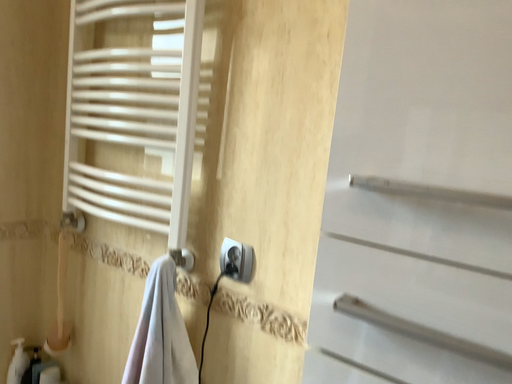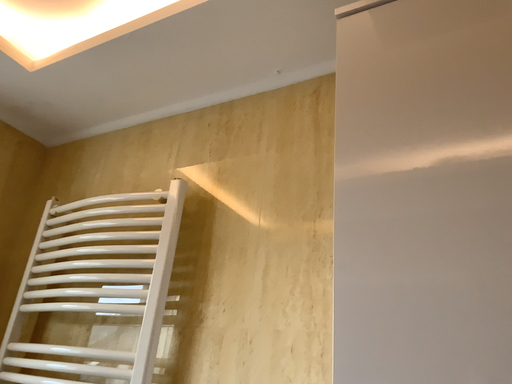
Question: How did the camera likely rotate when shooting the video?

Choices:
 (A) rotated left
 (B) rotated right

Answer: (B)